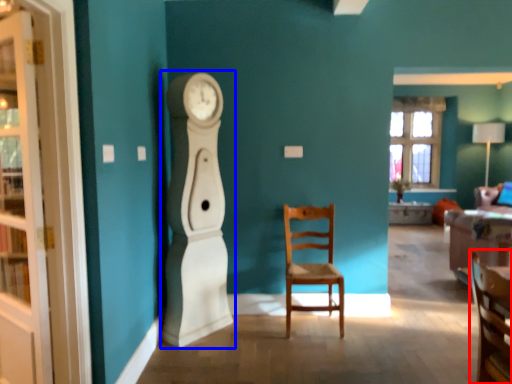
Question: Which point is closer to the camera, chair (highlighted by a red box) or clock (highlighted by a blue box)?

Choices:
 (A) chair
 (B) clock

Answer: (A)